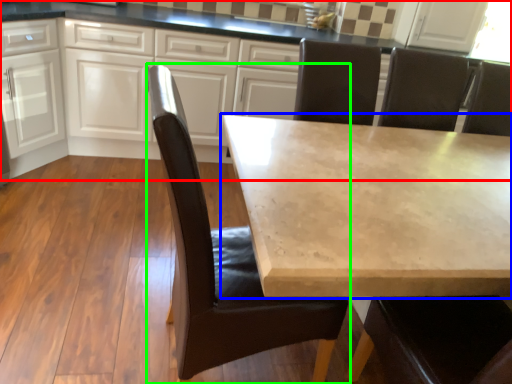
Question: Considering the real-world distances, which object is closest to cabinetry (highlighted by a red box)? table (highlighted by a blue box) or chair (highlighted by a green box).

Choices:
 (A) table
 (B) chair

Answer: (A)